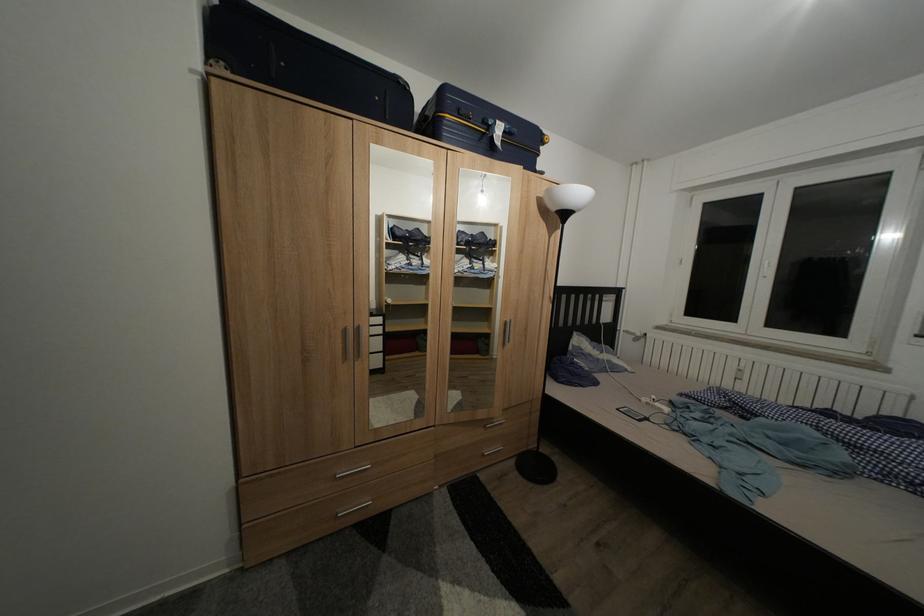
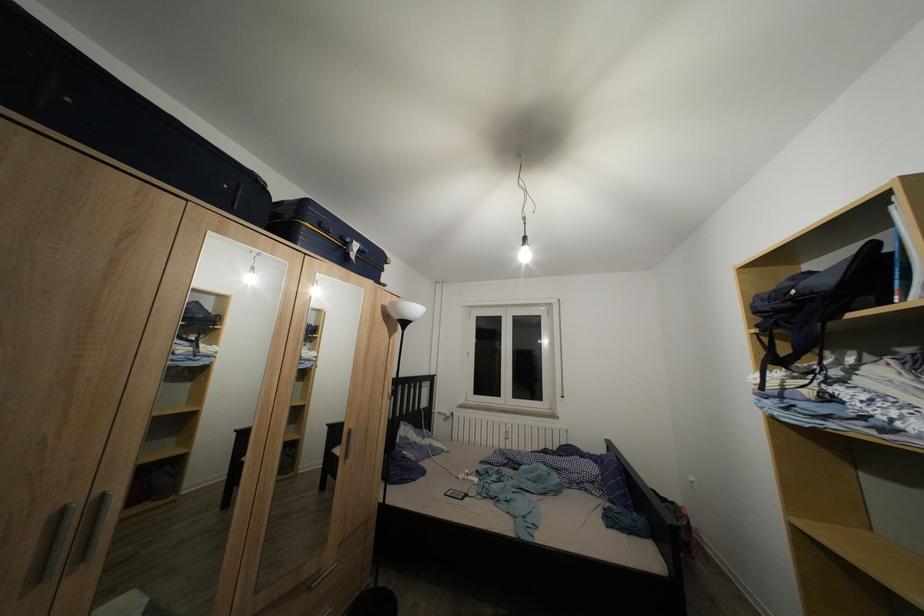
In the second image, find the point that corresponds to point (367, 333) in the first image.

(111, 503)